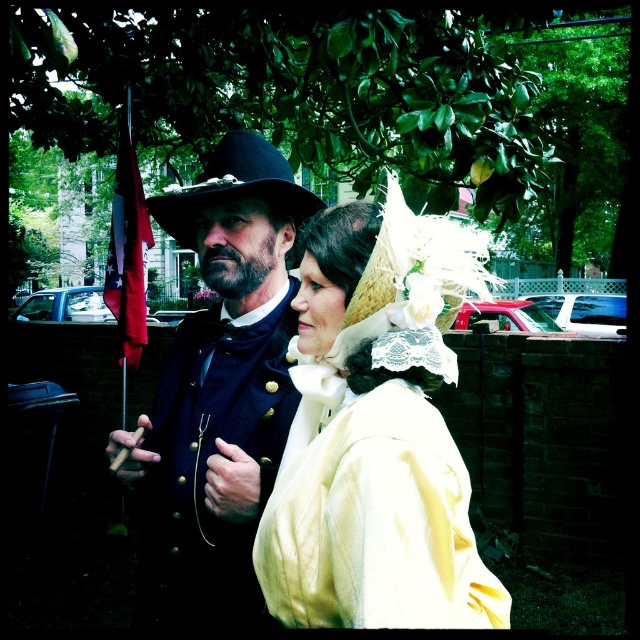
How much distance is there between matte white lace bonnet at center and black felt dress hat at upper center?

17.64 inches

Does matte white lace bonnet at center have a lesser height compared to black felt dress hat at upper center?

In fact, matte white lace bonnet at center may be taller than black felt dress hat at upper center.

Is point (314, 508) farther from camera compared to point (220, 196)?

No, (314, 508) is in front of (220, 196).

This screenshot has height=640, width=640. I want to click on matte white lace bonnet at center, so click(x=376, y=433).

Can you confirm if matte black hat at center is positioned above black felt dress hat at upper center?

Incorrect, matte black hat at center is not positioned above black felt dress hat at upper center.

What do you see at coordinates (218, 392) in the screenshot? The width and height of the screenshot is (640, 640). I see `matte black hat at center` at bounding box center [218, 392].

Between point (218, 396) and point (272, 186), which one is positioned behind?

Point (218, 396)

At what (x,y) coordinates should I click in order to perform the action: click on matte black hat at center. Please return your answer as a coordinate pair (x, y). Image resolution: width=640 pixels, height=640 pixels. Looking at the image, I should click on (218, 392).

Is the position of matte white lace bonnet at center less distant than that of matte black hat at center?

Yes, matte white lace bonnet at center is in front of matte black hat at center.

Is matte white lace bonnet at center to the left of matte black hat at center from the viewer's perspective?

No, matte white lace bonnet at center is not to the left of matte black hat at center.

Does point (332, 524) lie in front of point (227, 234)?

Yes.

Identify the location of matte white lace bonnet at center. The height and width of the screenshot is (640, 640). (376, 433).